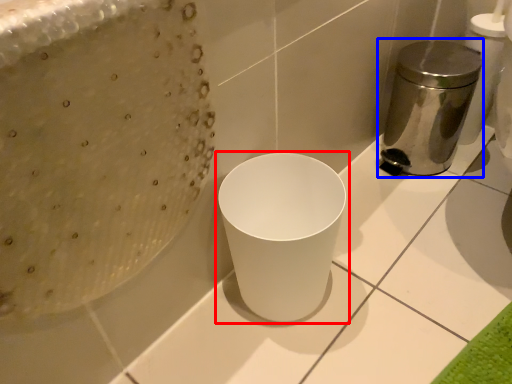
Question: Which object is further to the camera taking this photo, waste container (highlighted by a red box) or appliance (highlighted by a blue box)?

Choices:
 (A) waste container
 (B) appliance

Answer: (B)